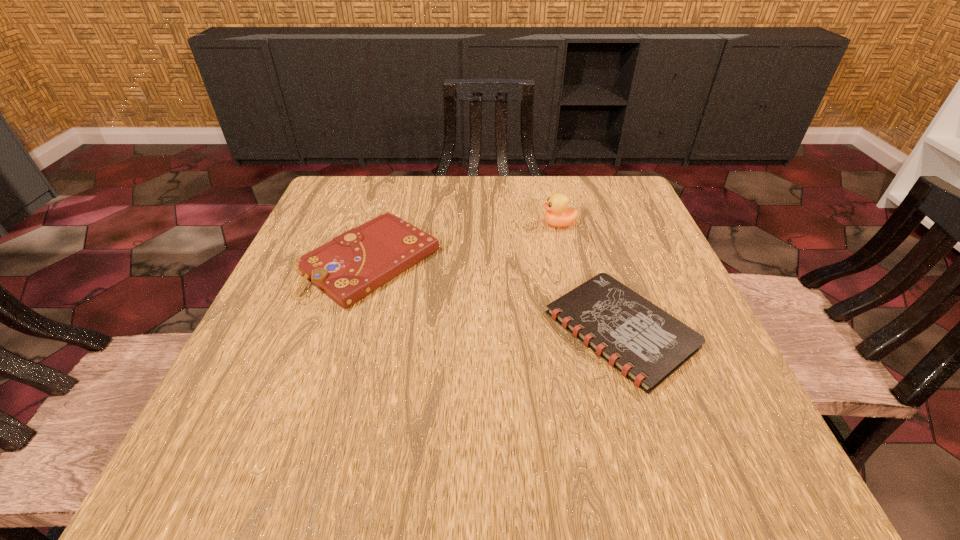
Locate an element on the screen. This screenshot has height=540, width=960. vacant region that satisfies the following two spatial constraints: 1. on the front side of the shorter notebook; 2. on the left side of the leftmost object is located at coordinates (349, 330).

Identify the location of vacant region that satisfies the following two spatial constraints: 1. on the face of the tallest object; 2. on the left side of the shorter notebook. (584, 330).